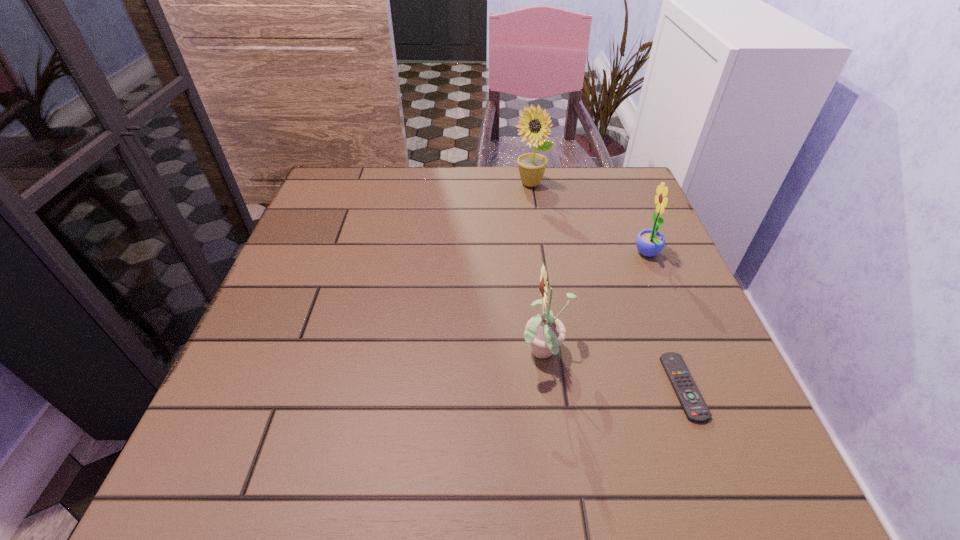
Where is `free space that satisfies the following two spatial constraints: 1. on the front-facing side of the nearest sunflower; 2. on the right side of the remote control`? This screenshot has height=540, width=960. free space that satisfies the following two spatial constraints: 1. on the front-facing side of the nearest sunflower; 2. on the right side of the remote control is located at coordinates (549, 387).

Locate an element on the screen. This screenshot has width=960, height=540. free space that satisfies the following two spatial constraints: 1. on the front-facing side of the shortest object; 2. on the right side of the nearest sunflower is located at coordinates (549, 387).

Find the location of `free spot that satisfies the following two spatial constraints: 1. on the front-facing side of the nearest sunflower; 2. on the right side of the shortest object`. free spot that satisfies the following two spatial constraints: 1. on the front-facing side of the nearest sunflower; 2. on the right side of the shortest object is located at coordinates (549, 387).

You are a GUI agent. You are given a task and a screenshot of the screen. Output one action in this format:
    pyautogui.click(x=<x>, y=<y>)
    Task: Click on the vacant space that satisfies the following two spatial constraints: 1. on the face of the farthest sunflower; 2. on the front-facing side of the nearest sunflower
    Image resolution: width=960 pixels, height=540 pixels.
    Given the screenshot: What is the action you would take?
    pyautogui.click(x=556, y=354)

You are a GUI agent. You are given a task and a screenshot of the screen. Output one action in this format:
    pyautogui.click(x=<x>, y=<y>)
    Task: Click on the blank area in the image that satisfies the following two spatial constraints: 1. on the back side of the remote control; 2. on the front-facing side of the nearest sunflower
    This screenshot has height=540, width=960.
    Given the screenshot: What is the action you would take?
    pyautogui.click(x=671, y=354)

Locate an element on the screen. This screenshot has height=540, width=960. vacant region that satisfies the following two spatial constraints: 1. on the back side of the shortest object; 2. on the front-facing side of the nearest sunflower is located at coordinates click(671, 354).